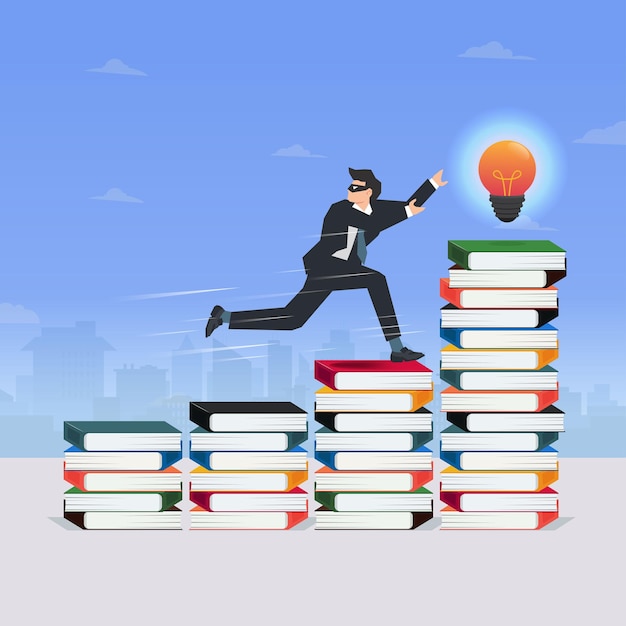
Locate an element on the screen. Image resolution: width=626 pixels, height=626 pixels. books with bright salmon colored covers is located at coordinates (541, 516), (543, 401), (451, 297), (419, 479), (295, 523), (74, 483).